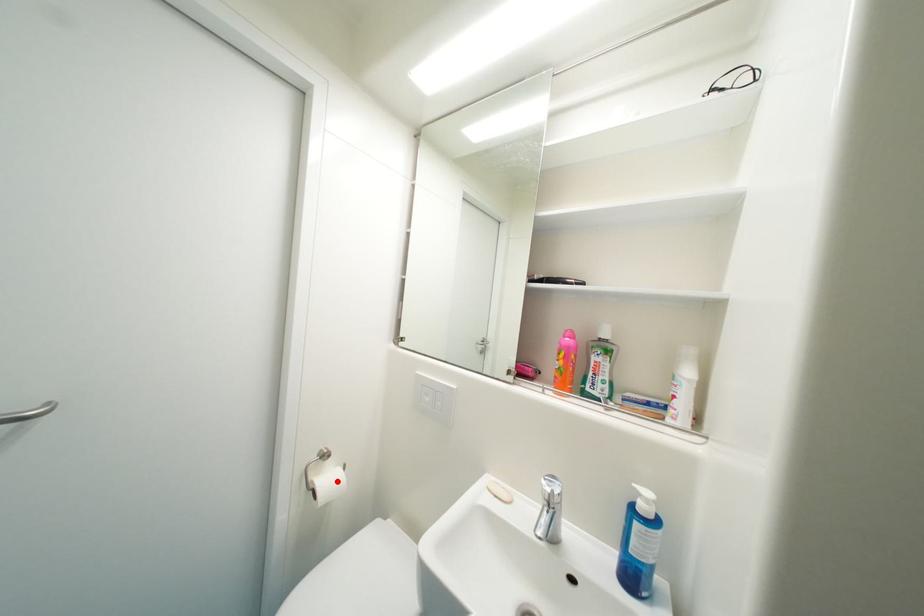
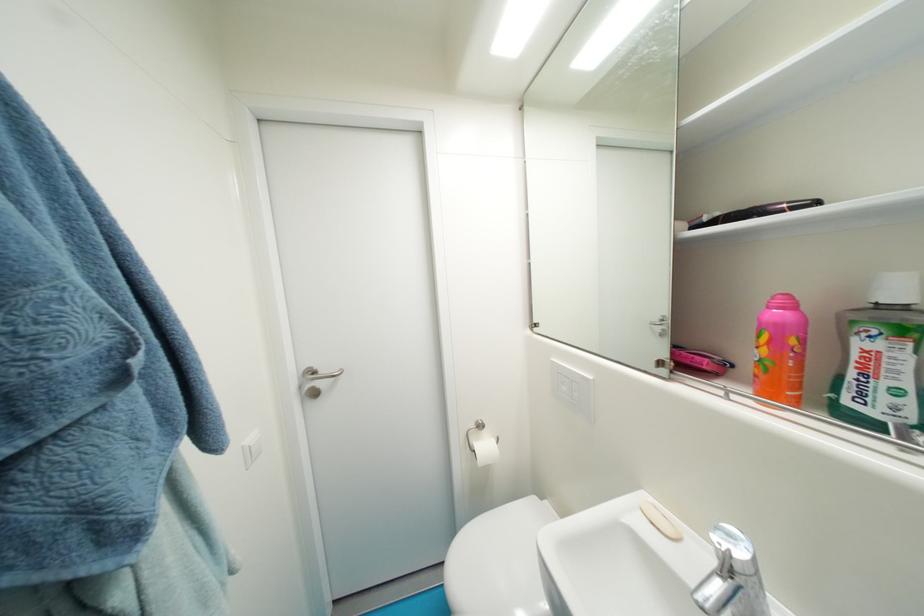
Question: I am providing you with two images of the same scene from different viewpoints. Image1 has a red point marked. In image2, the corresponding 3D location appears at what relative position? Reply with the corresponding letter.

Choices:
 (A) Closer
 (B) Farther

Answer: (B)